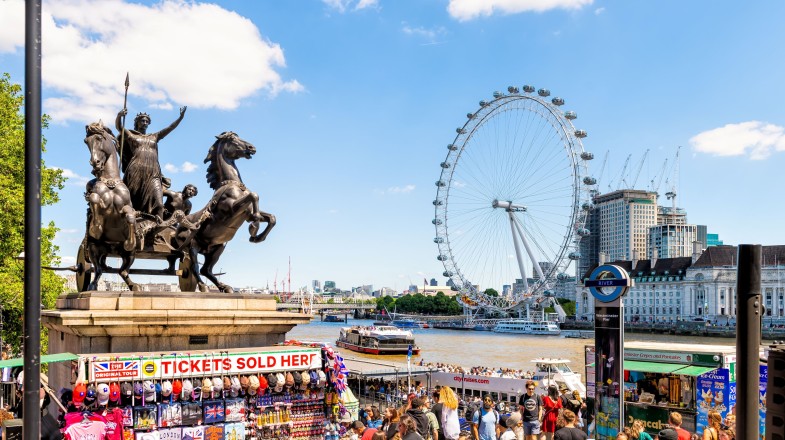
The height and width of the screenshot is (440, 785). In order to click on statue in this screenshot , I will do `click(159, 227)`.